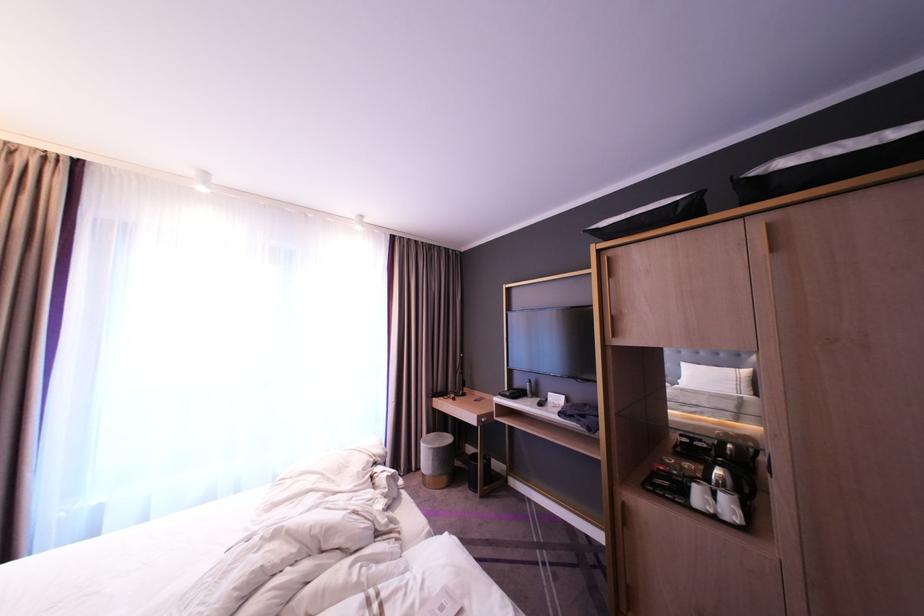
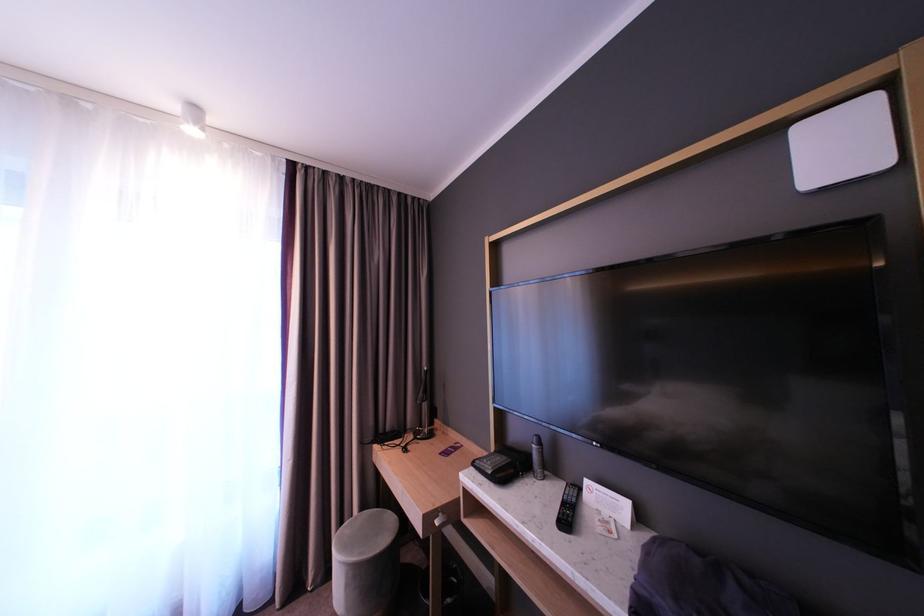
Question: In a continuous first-person perspective shot, in which direction is the camera moving?

Choices:
 (A) Left
 (B) Right
 (C) Forward
 (D) Backward

Answer: (C)